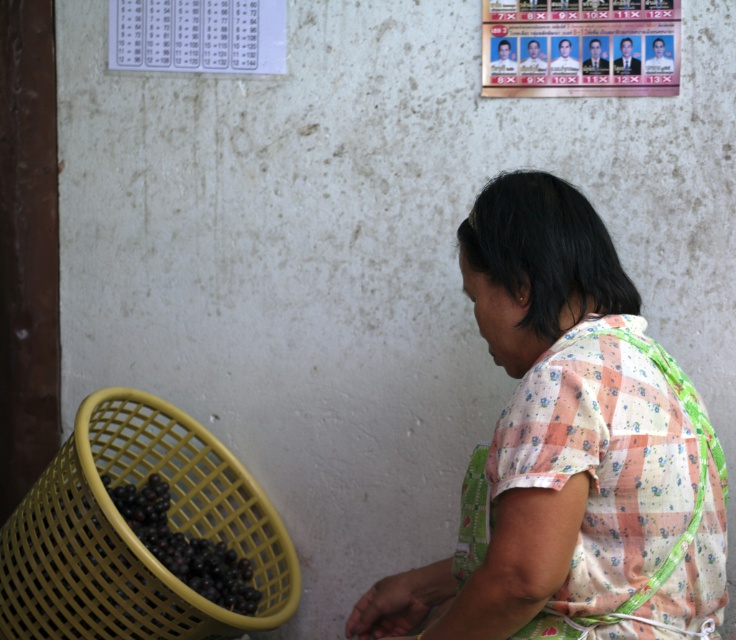
Question: Which of the following is the farthest from the observer?

Choices:
 (A) shiny purple grapes at lower left
 (B) white checkered shirt at center

Answer: (A)

Question: Is white checkered shirt at center closer to the viewer compared to shiny purple grapes at lower left?

Choices:
 (A) no
 (B) yes

Answer: (B)

Question: Which object appears farthest from the camera in this image?

Choices:
 (A) yellow plastic basket at lower left
 (B) shiny purple grapes at lower left
 (C) white checkered shirt at center

Answer: (B)

Question: Is yellow plastic basket at lower left bigger than shiny purple grapes at lower left?

Choices:
 (A) yes
 (B) no

Answer: (A)

Question: Among these points, which one is farthest from the camera?

Choices:
 (A) (138, 536)
 (B) (74, 620)
 (C) (470, 266)

Answer: (A)

Question: Is yellow plastic basket at lower left further to camera compared to shiny purple grapes at lower left?

Choices:
 (A) yes
 (B) no

Answer: (B)